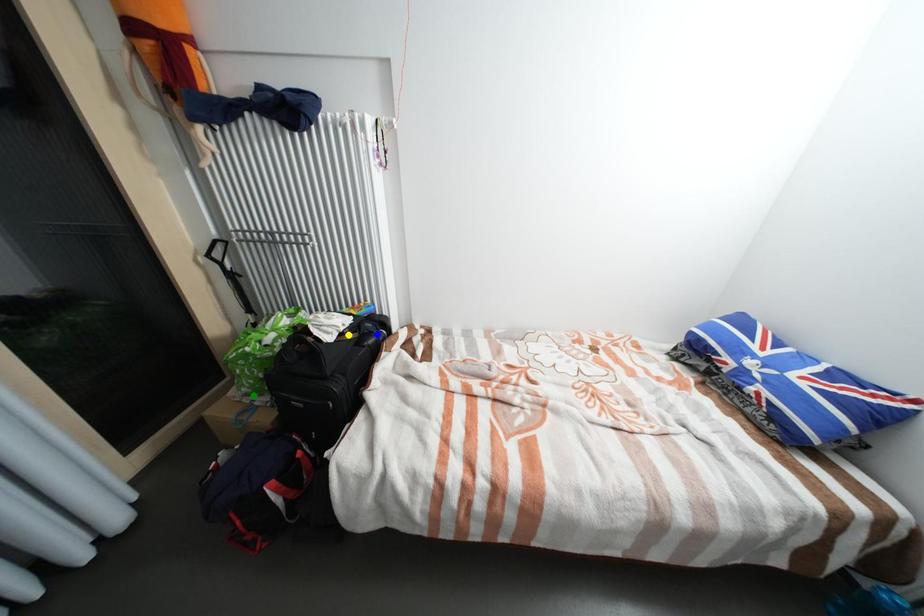
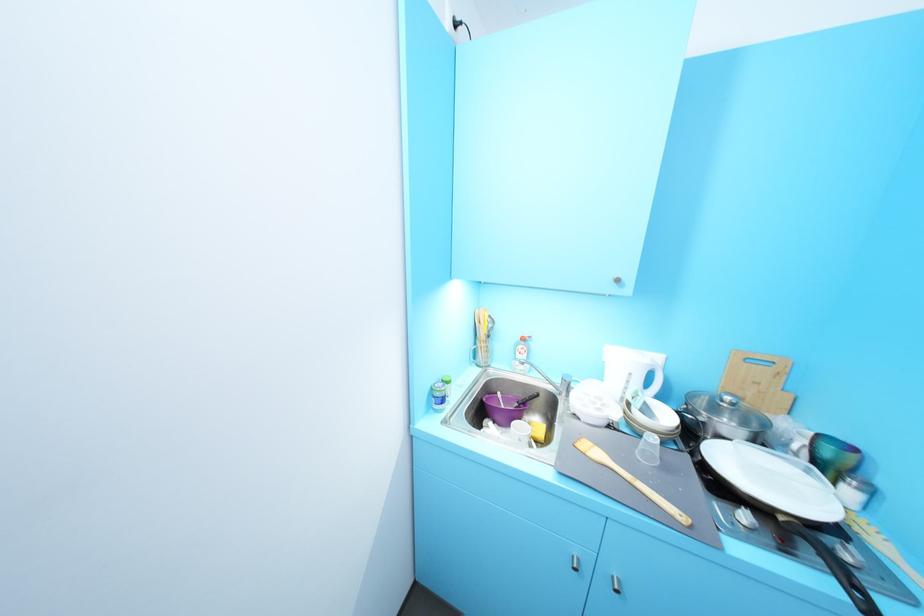
I am providing you with two images of the same scene from different viewpoints. Three points are marked in image1. Which point corresponds to a part or object that is occluded in image2?In image1, three points are marked. Which of them correspond to a part or object that is occluded in image2?Among the three points shown in image1, which one corresponds to a part or object that is no longer visible due to occlusion in image2?

blue point, green point, yellow point